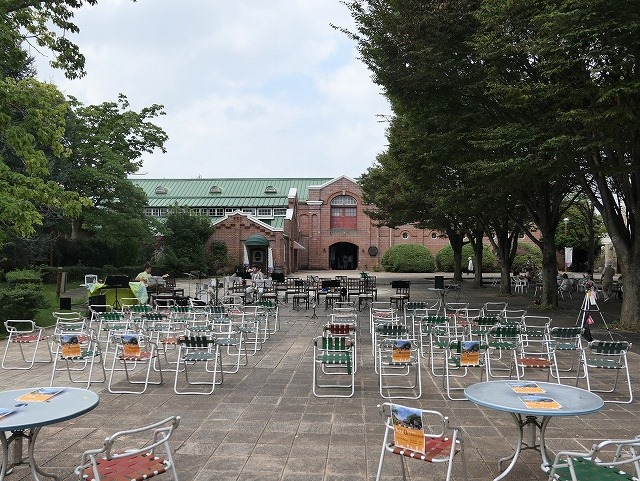
This screenshot has width=640, height=481. I want to click on entryway, so click(x=342, y=258), click(x=257, y=259).